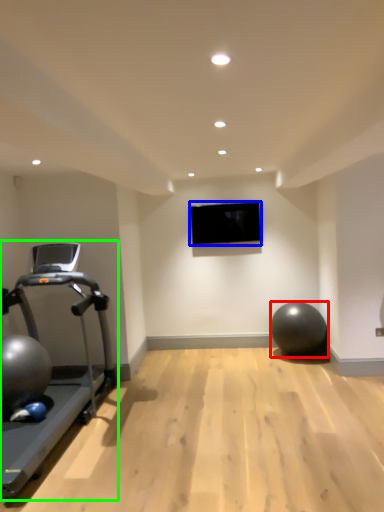
Question: Which is farther away from ball (highlighted by a red box)? projection screen (highlighted by a blue box) or treadmill (highlighted by a green box)?

Choices:
 (A) projection screen
 (B) treadmill

Answer: (B)